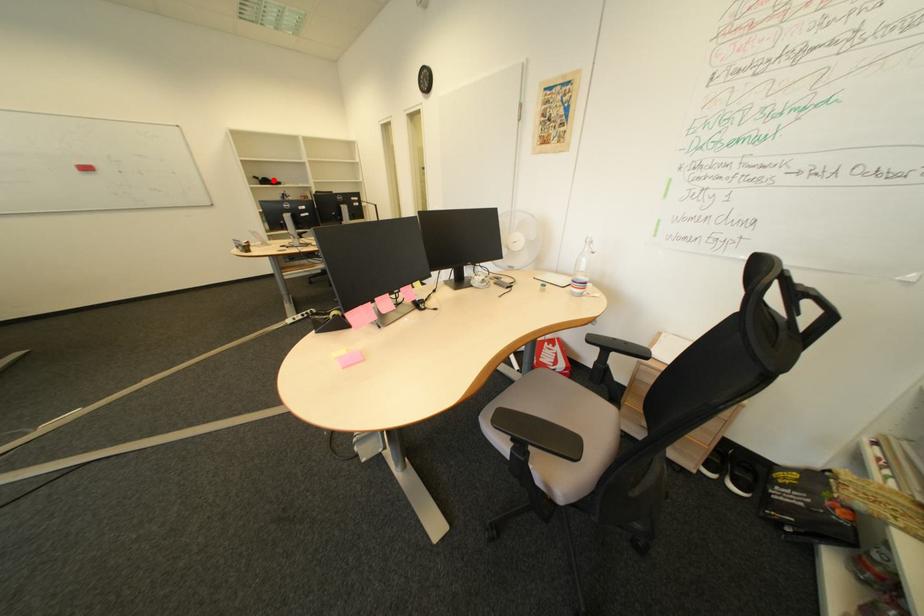
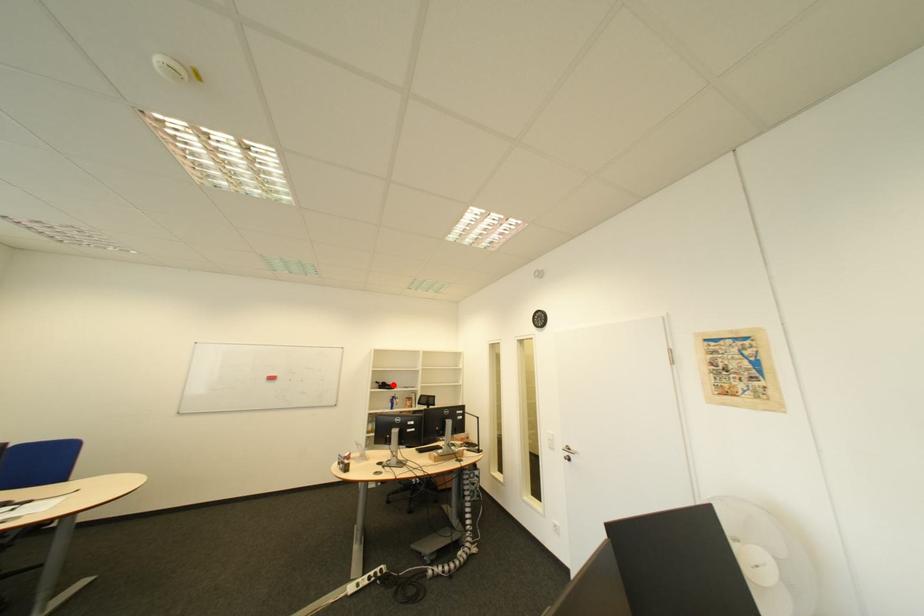
I am providing you with two images of the same scene from different viewpoints. A red point is marked on the first image and another point is marked on the second image. Are the points marked in image1 and image2 representing the same 3D position?

Yes